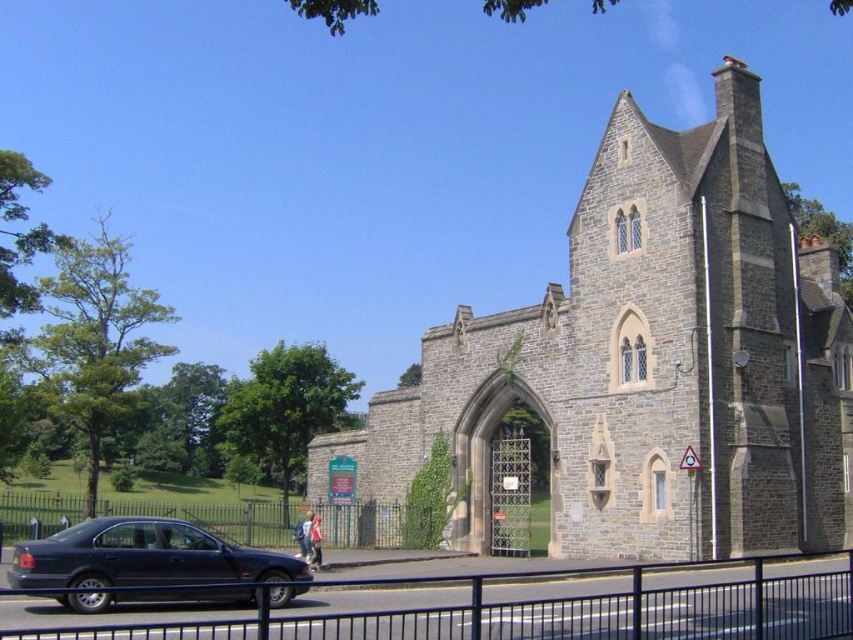
How far apart are gray stone church at center and metallic blue fence at lower center?

gray stone church at center and metallic blue fence at lower center are 14.09 meters apart from each other.

Is gray stone church at center in front of metallic blue fence at lower center?

No, gray stone church at center is further to the viewer.

Does point (636, 310) lie behind point (421, 608)?

That is True.

You are a GUI agent. You are given a task and a screenshot of the screen. Output one action in this format:
    pyautogui.click(x=<x>, y=<y>)
    Task: Click on the gray stone church at center
    The height and width of the screenshot is (640, 853).
    Given the screenshot: What is the action you would take?
    pyautogui.click(x=648, y=362)

Does matte black car at lower left lie behind green metal fence at lower center?

No, matte black car at lower left is closer to the viewer.

Is matte black car at lower left shorter than green metal fence at lower center?

Correct, matte black car at lower left is not as tall as green metal fence at lower center.

Locate an element on the screen. This screenshot has width=853, height=640. matte black car at lower left is located at coordinates (143, 563).

Does metallic blue fence at lower center lie in front of green metal fence at lower center?

Yes.

In the scene shown: Which of these two, metallic blue fence at lower center or green metal fence at lower center, stands shorter?

Standing shorter between the two is metallic blue fence at lower center.

Measure the distance between metallic blue fence at lower center and camera.

metallic blue fence at lower center and camera are 27.89 meters apart from each other.

Locate an element on the screen. This screenshot has height=640, width=853. metallic blue fence at lower center is located at coordinates (595, 605).